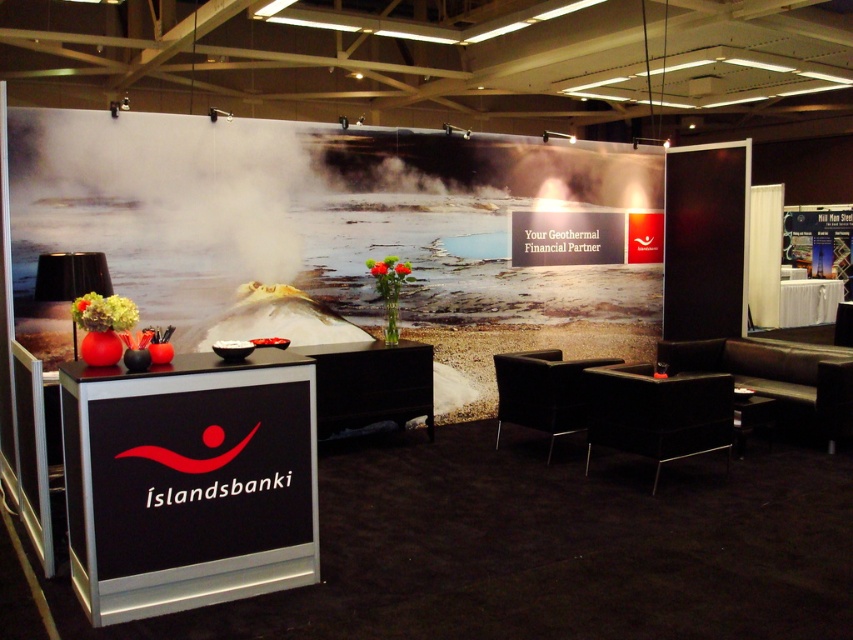
Question: Estimate the real-world distances between objects in this image. Which object is farther from the dark brown leather armchair at center?

Choices:
 (A) black metallic table at lower left
 (B) black glossy table at center

Answer: (A)

Question: Is black leather armchair at lower right positioned before black glossy table at center?

Choices:
 (A) no
 (B) yes

Answer: (B)

Question: Where is black metallic table at lower left located in relation to dark brown leather armchair at center in the image?

Choices:
 (A) below
 (B) above

Answer: (A)

Question: Which object appears farthest from the camera in this image?

Choices:
 (A) black leather armchair at lower right
 (B) black metallic table at lower left
 (C) black glossy table at center
 (D) dark brown leather armchair at center

Answer: (C)

Question: Can you confirm if black metallic table at lower left is smaller than dark brown leather armchair at center?

Choices:
 (A) yes
 (B) no

Answer: (B)

Question: Which point is closer to the camera?

Choices:
 (A) dark brown leather armchair at center
 (B) black leather armchair at lower right
 (C) black glossy table at center

Answer: (B)